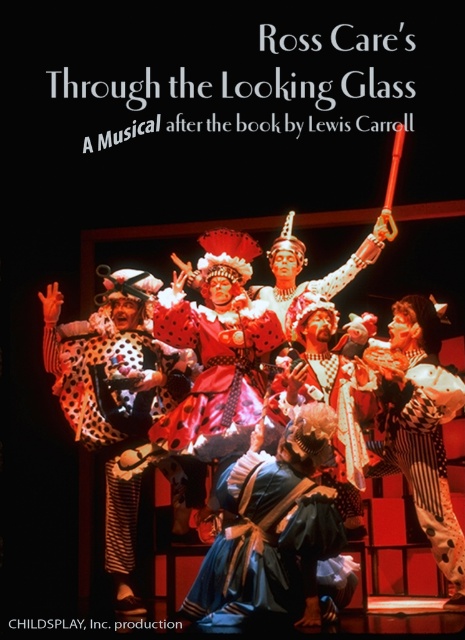
Consider the image. You are an event planner looking at the promotional poster for Ross Care. You need to determine the spatial relationship between the blue satin dress at center and the white polka dot fabric at center. Which object is closer to the viewer?

The blue satin dress at center is in front of the white polka dot fabric at center, so it is closer to the viewer.